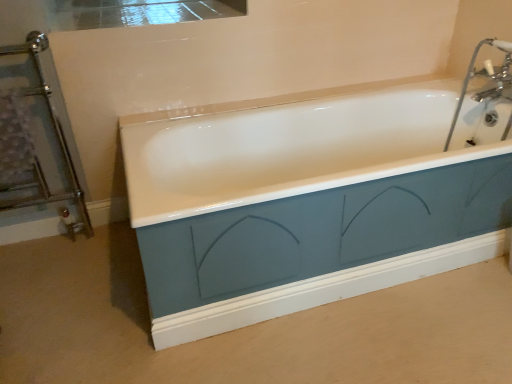
This screenshot has width=512, height=384. Describe the element at coordinates (58, 141) in the screenshot. I see `chrome metallic towel rack at left` at that location.

I want to click on chrome metallic towel rack at left, so click(58, 141).

Where is `chrome metallic faucet at upper right`? Image resolution: width=512 pixels, height=384 pixels. chrome metallic faucet at upper right is located at coordinates (488, 77).

Describe the element at coordinates (488, 77) in the screenshot. The width and height of the screenshot is (512, 384). I see `chrome metallic faucet at upper right` at that location.

Identify the location of chrome metallic towel rack at left. This screenshot has width=512, height=384. (58, 141).

Considering the positions of objects chrome metallic faucet at upper right and chrome metallic towel rack at left in the image provided, who is more to the left, chrome metallic faucet at upper right or chrome metallic towel rack at left?

From the viewer's perspective, chrome metallic towel rack at left appears more on the left side.

Which object is more forward, chrome metallic faucet at upper right or chrome metallic towel rack at left?

Positioned in front is chrome metallic towel rack at left.

Does point (504, 59) appear closer or farther from the camera than point (20, 201)?

Point (504, 59) is farther from the camera than point (20, 201).

From the image's perspective, is chrome metallic faucet at upper right located above or below chrome metallic towel rack at left?

chrome metallic faucet at upper right is situated higher than chrome metallic towel rack at left in the image.

From a real-world perspective, which object stands above the other?

chrome metallic faucet at upper right is physically above.

Does chrome metallic faucet at upper right have a lesser width compared to chrome metallic towel rack at left?

No, chrome metallic faucet at upper right is not thinner than chrome metallic towel rack at left.

Who is taller, chrome metallic faucet at upper right or chrome metallic towel rack at left?

chrome metallic towel rack at left is taller.

Considering the relative sizes of chrome metallic faucet at upper right and chrome metallic towel rack at left in the image provided, is chrome metallic faucet at upper right smaller than chrome metallic towel rack at left?

Indeed, chrome metallic faucet at upper right has a smaller size compared to chrome metallic towel rack at left.

Which is correct: chrome metallic faucet at upper right is inside chrome metallic towel rack at left, or outside of it?

chrome metallic faucet at upper right is spatially situated outside chrome metallic towel rack at left.

Is chrome metallic faucet at upper right positioned far away from chrome metallic towel rack at left?

Yes, chrome metallic faucet at upper right and chrome metallic towel rack at left are located far from each other.

Is chrome metallic faucet at upper right looking in the opposite direction of chrome metallic towel rack at left?

No, chrome metallic faucet at upper right is not facing the opposite direction of chrome metallic towel rack at left.

What are the coordinates of `screen door below the chrome metallic faucet at upper right (from the image's perspective)` in the screenshot? It's located at (58, 141).

Which object is positioned more to the right, chrome metallic towel rack at left or chrome metallic faucet at upper right?

chrome metallic faucet at upper right.

Who is more distant, chrome metallic towel rack at left or chrome metallic faucet at upper right?

chrome metallic faucet at upper right is more distant.

Between point (28, 42) and point (447, 144), which one is positioned in front?

The point (28, 42) is closer.

From the image's perspective, does chrome metallic towel rack at left appear lower than chrome metallic faucet at upper right?

Yes, from the image's perspective, chrome metallic towel rack at left is beneath chrome metallic faucet at upper right.

From a real-world perspective, between chrome metallic towel rack at left and chrome metallic faucet at upper right, who is vertically lower?

chrome metallic towel rack at left.

Looking at this image, considering the sizes of objects chrome metallic towel rack at left and chrome metallic faucet at upper right in the image provided, who is wider, chrome metallic towel rack at left or chrome metallic faucet at upper right?

chrome metallic faucet at upper right is wider.

In terms of height, does chrome metallic towel rack at left look taller or shorter compared to chrome metallic faucet at upper right?

Considering their sizes, chrome metallic towel rack at left has more height than chrome metallic faucet at upper right.

In the scene shown: Who is bigger, chrome metallic towel rack at left or chrome metallic faucet at upper right?

chrome metallic towel rack at left.

Would you say chrome metallic towel rack at left is inside or outside chrome metallic faucet at upper right?

chrome metallic towel rack at left cannot be found inside chrome metallic faucet at upper right.

Is the surface of chrome metallic towel rack at left in direct contact with chrome metallic faucet at upper right?

No, chrome metallic towel rack at left is not making contact with chrome metallic faucet at upper right.

Could you tell me if chrome metallic towel rack at left is turned towards chrome metallic faucet at upper right?

No, chrome metallic towel rack at left is not turned towards chrome metallic faucet at upper right.

Looking at this image, how different are the orientations of chrome metallic towel rack at left and chrome metallic faucet at upper right in degrees?

89.6 degrees.

Where is `sink located above the chrome metallic towel rack at left (from the image's perspective)`? The image size is (512, 384). sink located above the chrome metallic towel rack at left (from the image's perspective) is located at coordinates (488, 77).

The height and width of the screenshot is (384, 512). In order to click on screen door lying below the chrome metallic faucet at upper right (from the image's perspective) in this screenshot , I will do `click(58, 141)`.

Identify the location of sink behind the chrome metallic towel rack at left. Image resolution: width=512 pixels, height=384 pixels. (488, 77).